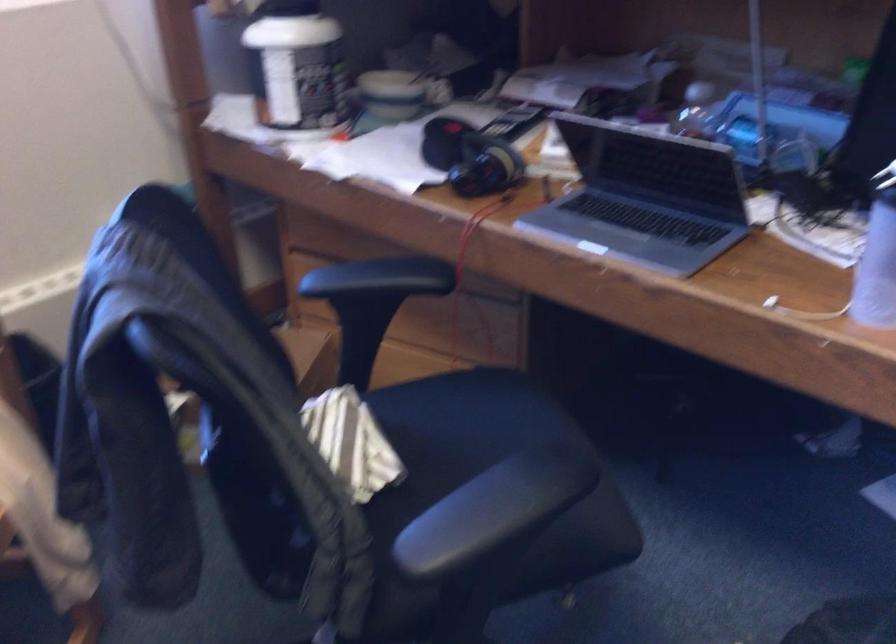
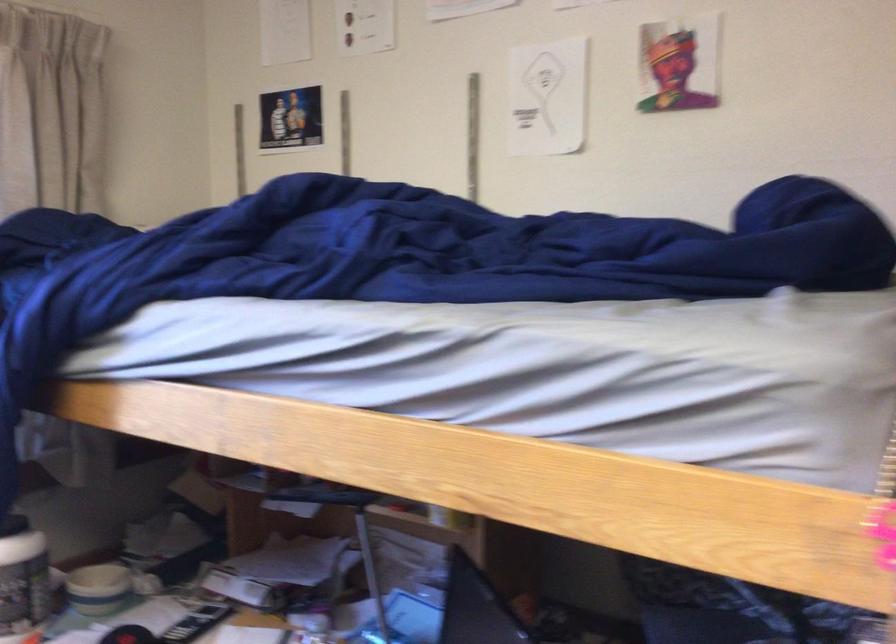
The point at (385, 90) is marked in the first image. Where is the corresponding point in the second image?

(98, 589)